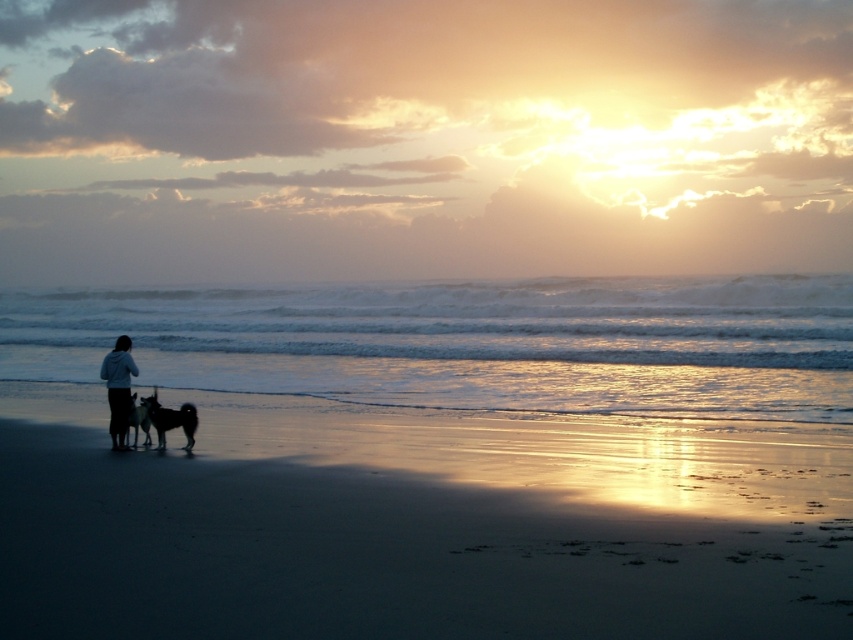
You are standing at the point marked as point (412,525) in the image. What is the terrain like at that location?

The terrain at point (412,525) is sandy beach at lower left.

You are a photographer trying to capture the sunset. You have a camera with a 24mm lens that can capture a width of 1 meter. You notice the light blue hoodie at left and the shiny black dog at lower left in your frame. Can both objects fit in your shot if they are side by side?

The light blue hoodie at left is wider than the shiny black dog at lower left. If placed side by side, their combined width would exceed the 1 meter capacity of the 24mm lens, so they might not both fit in the shot.

You are a photographer trying to capture the sunset with the light blue hoodie at left in the frame. Where should you position yourself to ensure the hoodie is visible along with the sunset?

The light blue hoodie at left is located at point (x=119, y=388), so you should position yourself to the left side of the frame to include both the hoodie and the sunset in your shot.